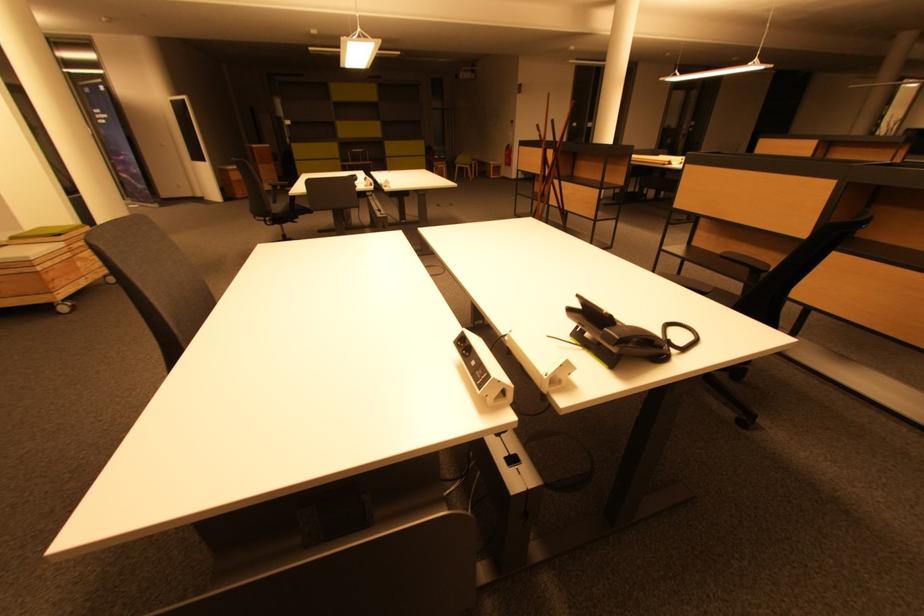
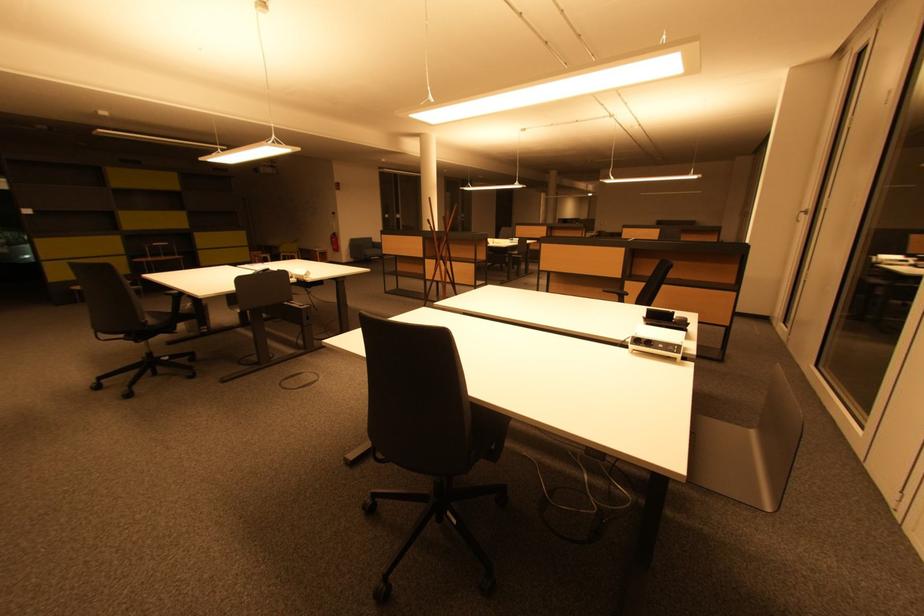
Find the pixel in the second image that matches [584,326] in the first image.

(661, 323)